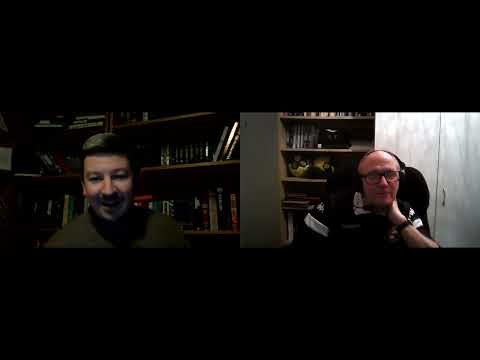
You are a GUI agent. You are given a task and a screenshot of the screen. Output one action in this format:
    pyautogui.click(x=<x>, y=<y>)
    Task: Click on the bookshelf
    Image resolution: width=480 pixels, height=360 pixels.
    Given the screenshot: What is the action you would take?
    pyautogui.click(x=284, y=178)